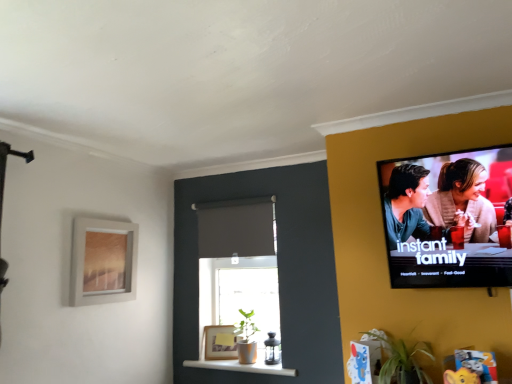
Locate an element on the screen. free space above matte gray curtain at center (from a real-world perspective) is located at coordinates (227, 198).